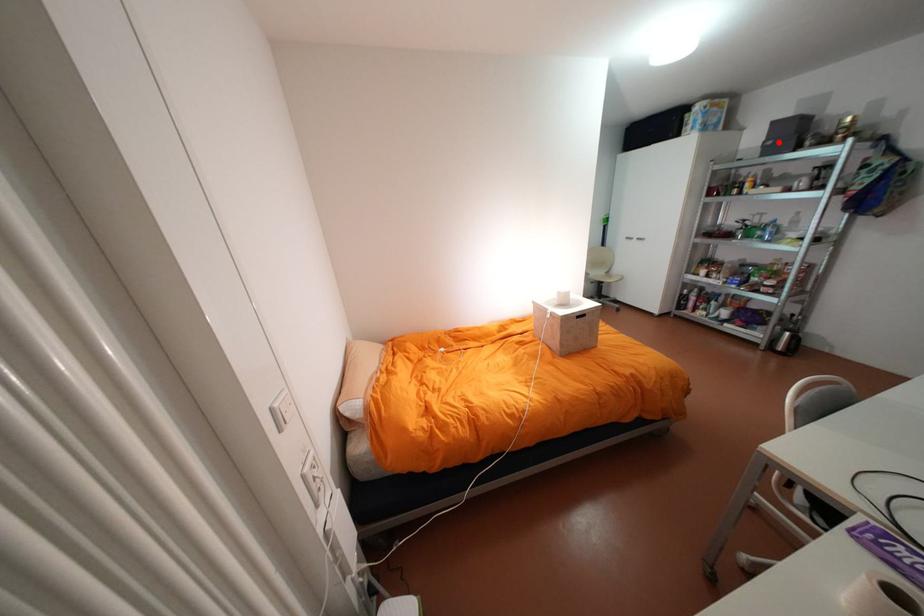
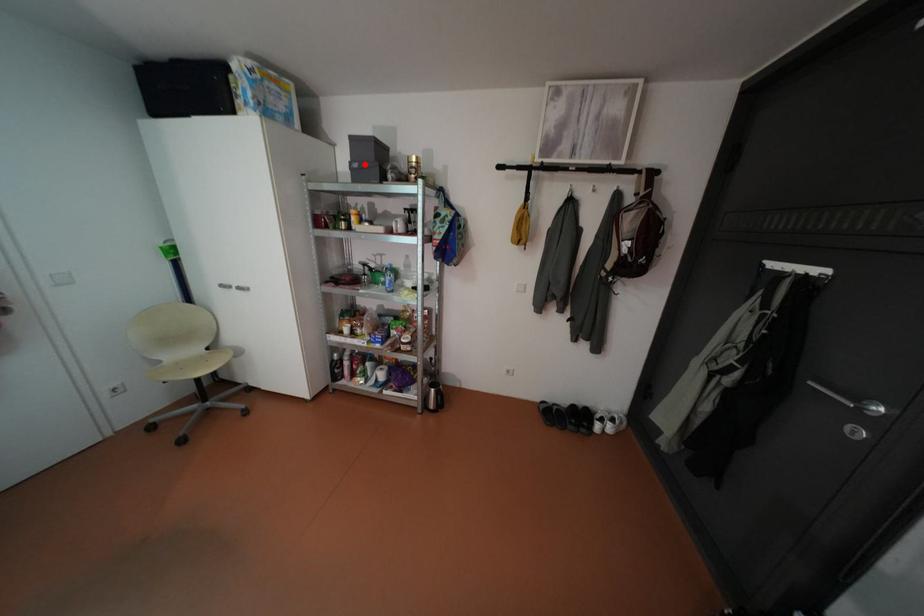
I am providing you with two images of the same scene from different viewpoints. A red point is marked on the first image and another point is marked on the second image. Is the red point in image1 aligned with the point shown in image2?

Yes